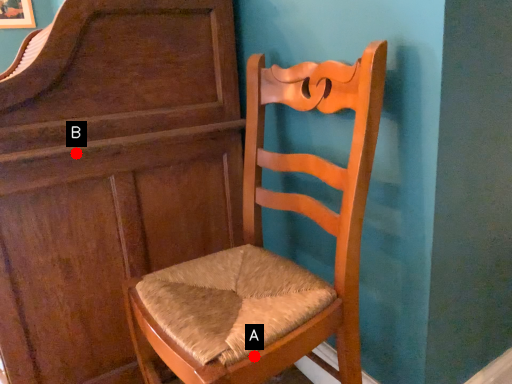
Question: Two points are circled on the image, labeled by A and B beside each circle. Among these points, which one is farthest from the camera?

Choices:
 (A) A is further
 (B) B is further

Answer: (B)